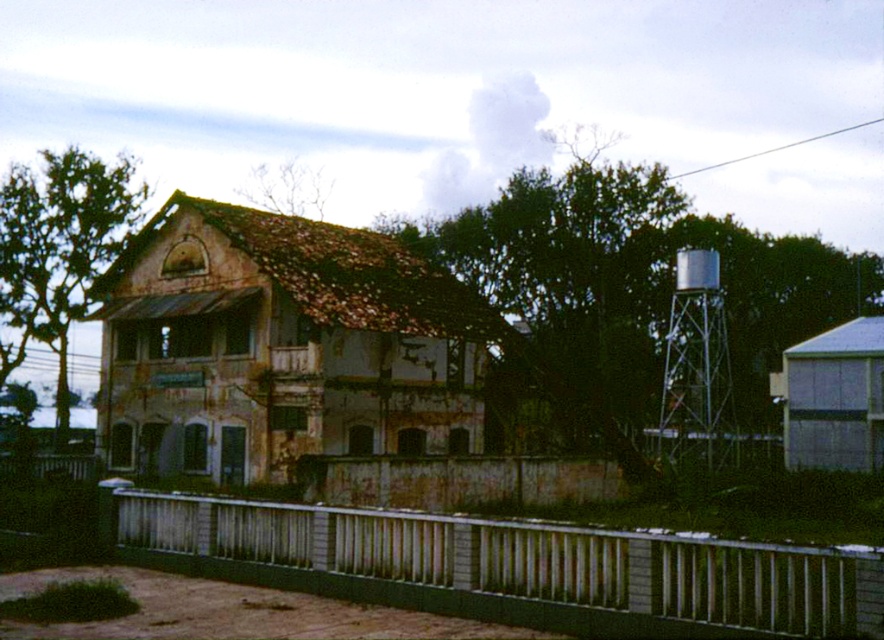
Question: Does white painted metal fence at lower center have a lesser width compared to silver metallic water tower at right?

Choices:
 (A) no
 (B) yes

Answer: (A)

Question: Which point is closer to the camera?

Choices:
 (A) (540, 621)
 (B) (697, 317)

Answer: (A)

Question: In this image, where is white painted metal fence at lower center located relative to silver metallic water tower at right?

Choices:
 (A) above
 (B) below

Answer: (B)

Question: Does white painted metal fence at lower center have a lesser width compared to silver metallic water tower at right?

Choices:
 (A) yes
 (B) no

Answer: (B)

Question: Among these objects, which one is farthest from the camera?

Choices:
 (A) silver metallic water tower at right
 (B) white painted metal fence at lower center

Answer: (A)